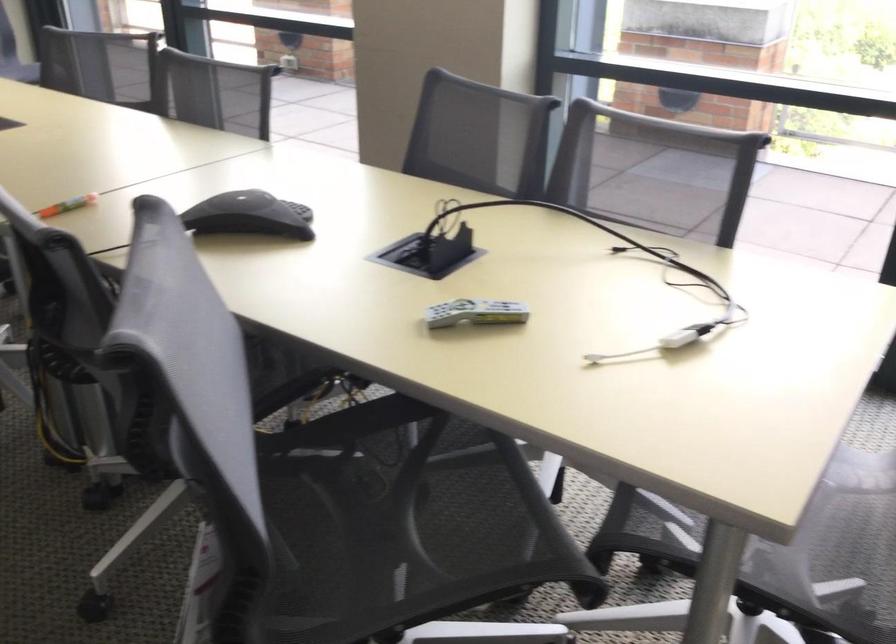
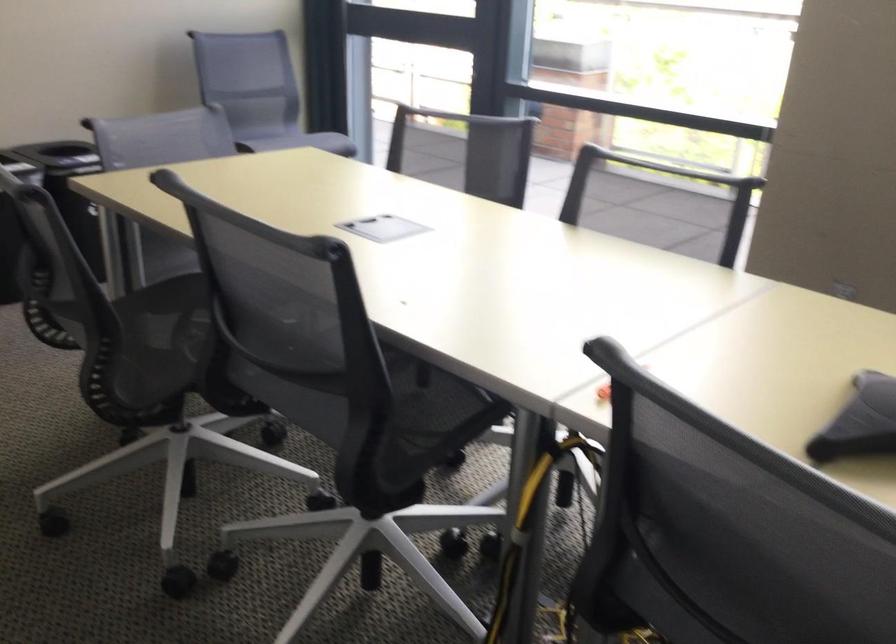
In a continuous first-person perspective shot, in which direction is the camera moving?

The movement direction of the cameraman is left, forward.